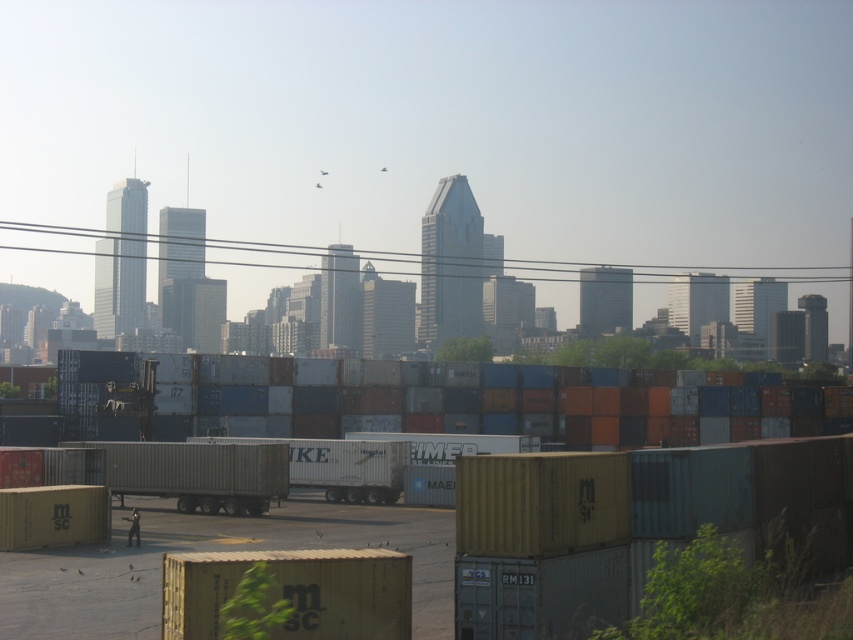
Question: Does metallic silver trailer truck at center have a larger size compared to white matte trailer truck at center?

Choices:
 (A) yes
 (B) no

Answer: (A)

Question: In this image, where is metallic silver trailer truck at center located relative to white matte trailer truck at center?

Choices:
 (A) below
 (B) above

Answer: (B)

Question: Considering the relative positions of metallic silver trailer truck at center and white matte trailer truck at center in the image provided, where is metallic silver trailer truck at center located with respect to white matte trailer truck at center?

Choices:
 (A) below
 (B) above

Answer: (B)

Question: Which object is closer to the camera taking this photo?

Choices:
 (A) metallic silver trailer truck at center
 (B) white matte trailer truck at center

Answer: (A)